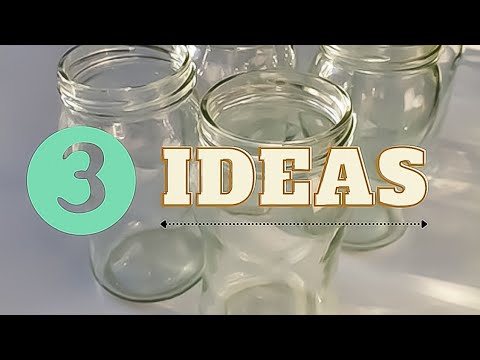
This screenshot has height=360, width=480. Find the location of `white table`. white table is located at coordinates (53, 254).